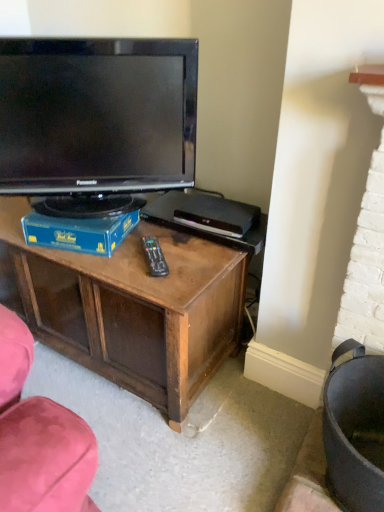
In order to click on blank space above blue cardboard box at center (from a real-world perspective) in this screenshot , I will do tap(89, 207).